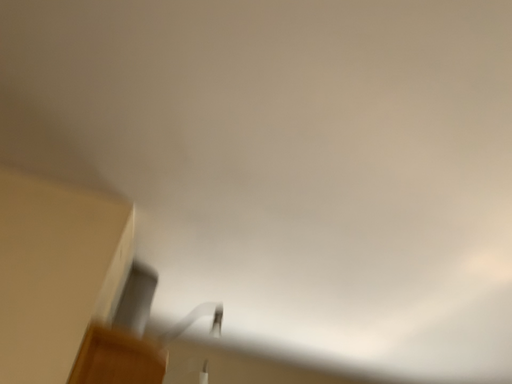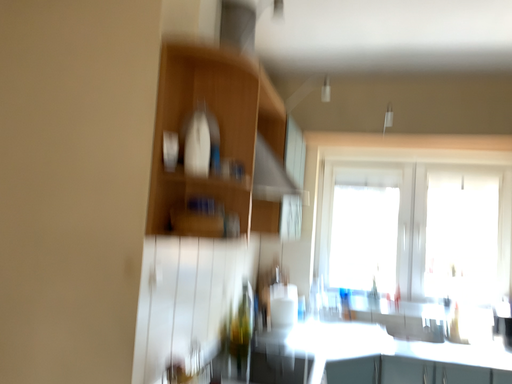
Question: How did the camera likely rotate when shooting the video?

Choices:
 (A) rotated downward
 (B) rotated upward

Answer: (A)